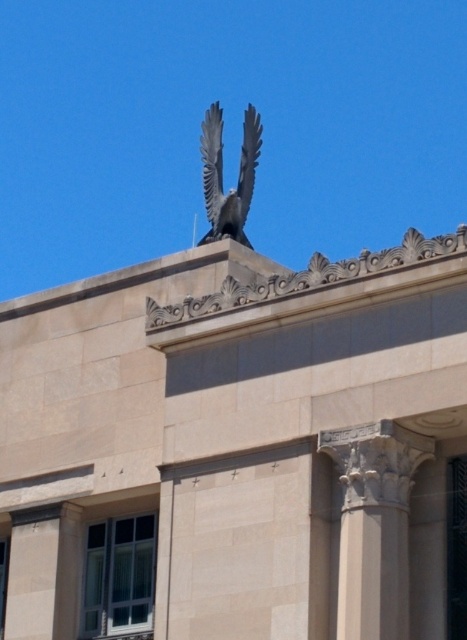
In the scene shown: Between gray stone column at center and polished bronze eagle at upper center, which one appears on the left side from the viewer's perspective?

polished bronze eagle at upper center

Is gray stone column at center smaller than polished bronze eagle at upper center?

Yes.

The height and width of the screenshot is (640, 467). Describe the element at coordinates (375, 524) in the screenshot. I see `gray stone column at center` at that location.

Where is `gray stone column at center`? gray stone column at center is located at coordinates (375, 524).